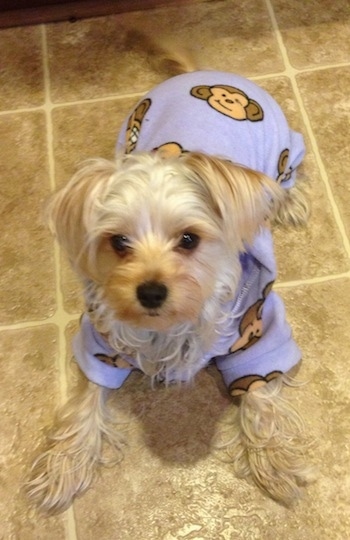
Where is `light stone tiled floor`? The width and height of the screenshot is (350, 540). light stone tiled floor is located at coordinates (42, 339), (66, 528), (338, 515), (340, 350), (339, 69), (32, 62).